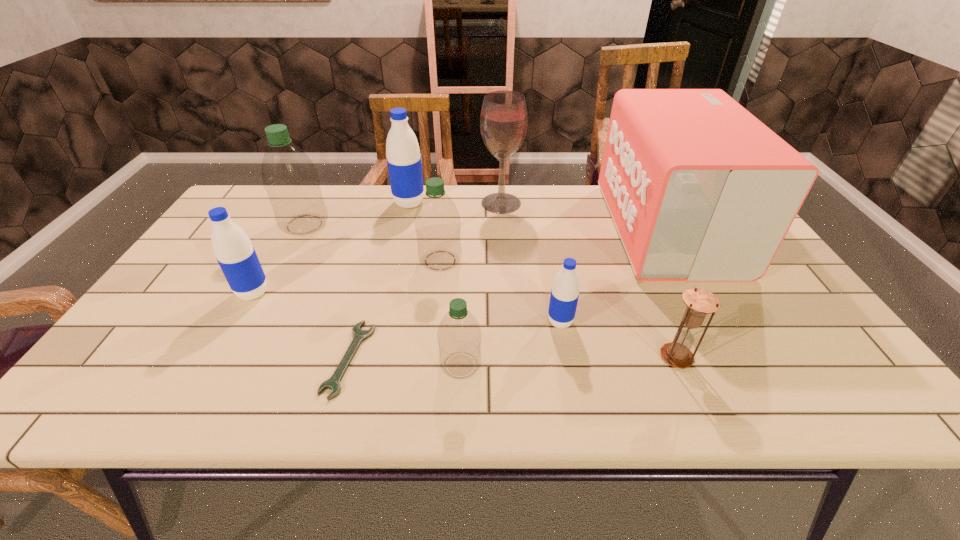
This screenshot has height=540, width=960. I want to click on free space between the second farthest green water bottle and the biggest green water bottle, so click(372, 242).

This screenshot has height=540, width=960. Find the location of `vacant area that lies between the wrench and the second farthest green water bottle`. vacant area that lies between the wrench and the second farthest green water bottle is located at coordinates (395, 309).

Locate an element on the screen. The width and height of the screenshot is (960, 540). free space between the alcohol and the second biggest green water bottle is located at coordinates (470, 232).

What are the coordinates of `free area in between the rightmost blue water bottle and the nearest green water bottle` in the screenshot? It's located at (511, 343).

I want to click on empty location between the fourth water bottle from right to left and the brown hourglass, so click(x=542, y=280).

You are a GUI agent. You are given a task and a screenshot of the screen. Output one action in this format:
    pyautogui.click(x=<x>, y=<y>)
    Task: Click on the free spot between the shortest object and the biggest blue water bottle
    The image size is (960, 540).
    Given the screenshot: What is the action you would take?
    379,281

Where is `vacant space that is in between the alcohol and the shortest object`? The width and height of the screenshot is (960, 540). vacant space that is in between the alcohol and the shortest object is located at coordinates (425, 281).

At what (x,y) coordinates should I click in order to perform the action: click on free spot between the shortest object and the alcohol. Please return your answer as a coordinate pair (x, y). The width and height of the screenshot is (960, 540). Looking at the image, I should click on (425, 281).

Locate an element on the screen. the closest object to the shortest object is located at coordinates (459, 336).

Locate which object is the fourth closest to the second blue water bottle from left to right. Please provide its 2D coordinates. Your answer should be formatted as a tuple, i.e. [(x, y)], where the tuple contains the x and y coordinates of a point satisfying the conditions above.

[(237, 258)]